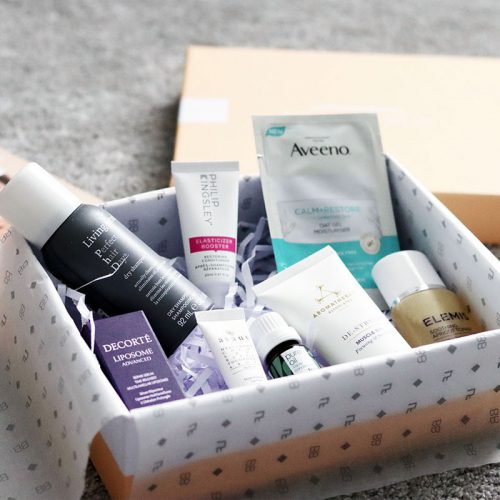
Where is `cream colored gift box lid`? This screenshot has height=500, width=500. cream colored gift box lid is located at coordinates (238, 94), (453, 154).